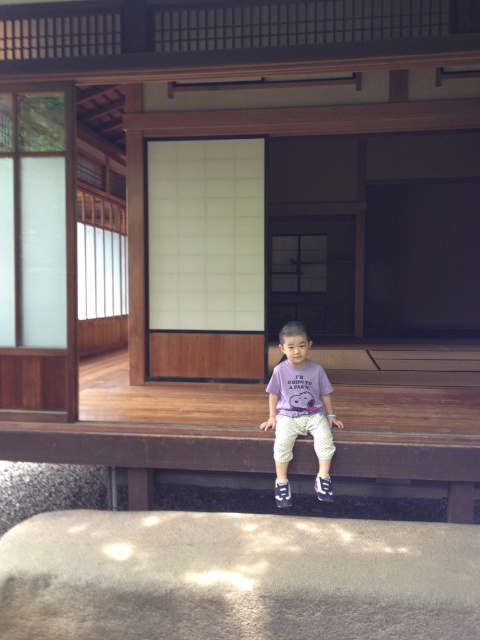
Does brown wooden ledge at lower center appear on the right side of purple cotton shirt at center?

No, brown wooden ledge at lower center is not to the right of purple cotton shirt at center.

Which of these two, brown wooden ledge at lower center or purple cotton shirt at center, stands shorter?

Standing shorter between the two is brown wooden ledge at lower center.

Does point (111, 445) lie in front of point (300, 365)?

No.

Where is `brown wooden ledge at lower center`? brown wooden ledge at lower center is located at coordinates (139, 449).